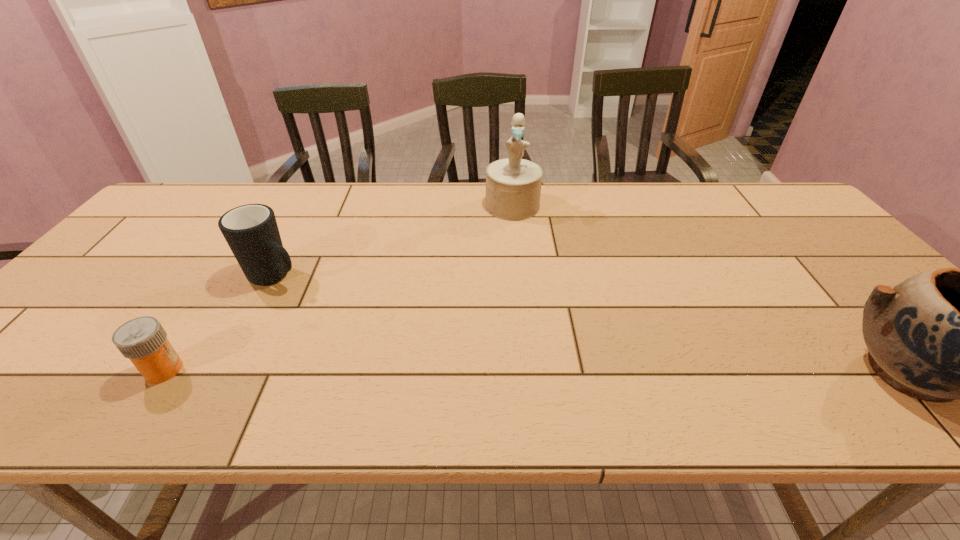
You are a GUI agent. You are given a task and a screenshot of the screen. Output one action in this format:
    pyautogui.click(x=<x>, y=<y>)
    Task: Click on the leftmost object
    
    Given the screenshot: What is the action you would take?
    pyautogui.click(x=143, y=340)

This screenshot has height=540, width=960. In order to click on the shortest object in this screenshot , I will do `click(143, 340)`.

What are the coordinates of `mug` in the screenshot? It's located at (251, 231).

At what (x,y) coordinates should I click in order to perform the action: click on the second object from left to right. Please return your answer as a coordinate pair (x, y). Looking at the image, I should click on (251, 231).

Identify the location of the tallest object. (513, 185).

I want to click on the second object from right to left, so click(x=513, y=185).

Where is `vacant space located on the label side of the medicine`? The width and height of the screenshot is (960, 540). vacant space located on the label side of the medicine is located at coordinates (221, 370).

The image size is (960, 540). In order to click on vacant space located on the side of the second shortest object with the handle in this screenshot , I will do `click(356, 314)`.

Where is `vacant space located on the side of the second shortest object with the handle`? This screenshot has height=540, width=960. vacant space located on the side of the second shortest object with the handle is located at coordinates (388, 330).

In order to click on vacant space located on the side of the second shortest object with the handle in this screenshot , I will do `click(420, 347)`.